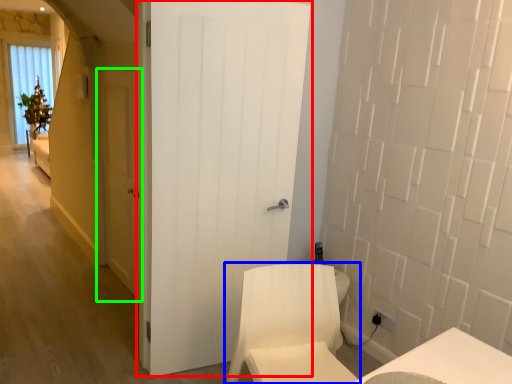
Question: Which object is positioned closest to door (highlighted by a red box)? Select from furniture (highlighted by a blue box) and door (highlighted by a green box).

Choices:
 (A) furniture
 (B) door

Answer: (A)